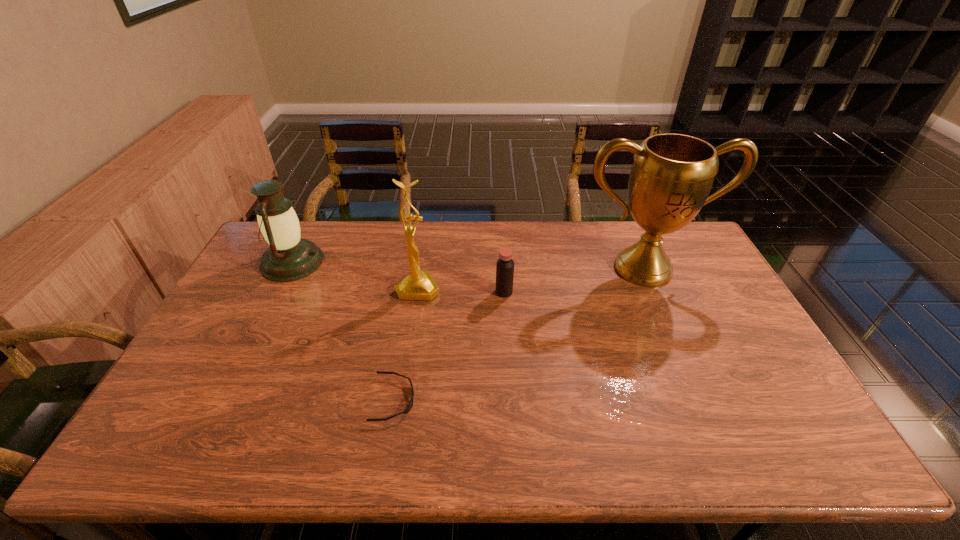
Image resolution: width=960 pixels, height=540 pixels. I want to click on vacant space situated 0.100m on the front-facing side of the fourth shortest object, so click(x=412, y=326).

Identify the location of free space located with the light compartment facing forward on the lantern. The height and width of the screenshot is (540, 960). (393, 262).

Image resolution: width=960 pixels, height=540 pixels. I want to click on free space located on the front of the second object from right to left, so click(505, 312).

At what (x,y) coordinates should I click in order to perform the action: click on vacant space positioned on the front-facing side of the sunglasses. Please return your answer as a coordinate pair (x, y). The image size is (960, 540). Looking at the image, I should click on (482, 400).

Locate an element on the screen. The image size is (960, 540). trophy cup situated at the far edge is located at coordinates (672, 174).

You are a GUI agent. You are given a task and a screenshot of the screen. Output one action in this format:
    pyautogui.click(x=<x>, y=<y>)
    Task: Click on the lantern at the far edge
    The height and width of the screenshot is (540, 960).
    Given the screenshot: What is the action you would take?
    pyautogui.click(x=289, y=257)

Where is `object present at the left edge`? object present at the left edge is located at coordinates [x=289, y=257].

The image size is (960, 540). In order to click on object situated at the right edge in this screenshot , I will do `click(672, 174)`.

In order to click on object present at the far left corner in this screenshot , I will do `click(289, 257)`.

What are the coordinates of `object positioned at the far right corner` in the screenshot? It's located at (672, 174).